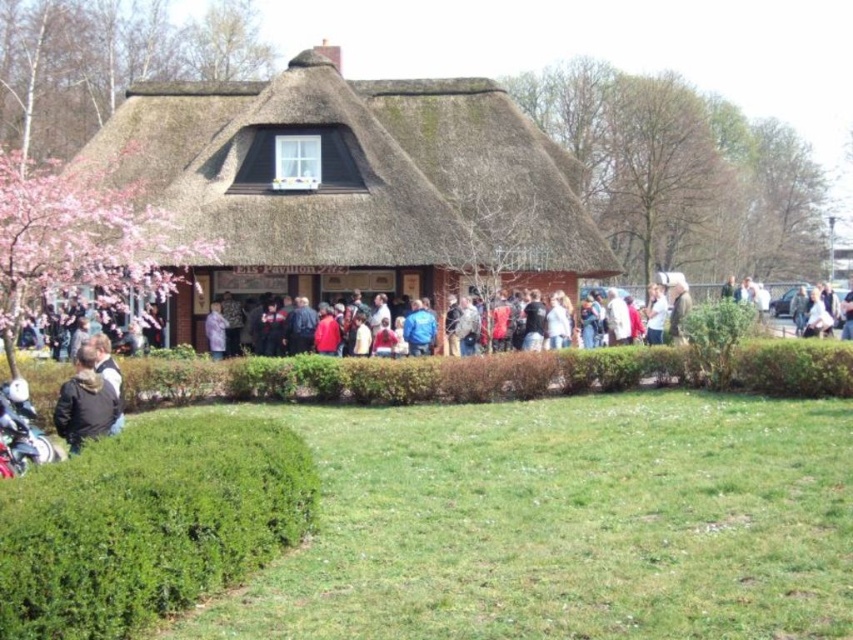
Question: Which object is closer to the camera taking this photo?

Choices:
 (A) green leafy hedge at lower left
 (B) green leafy hedge at center
 (C) green grass at center

Answer: (C)

Question: Is green leafy hedge at lower left further to the viewer compared to green leafy hedge at center?

Choices:
 (A) no
 (B) yes

Answer: (A)

Question: Among these objects, which one is farthest from the camera?

Choices:
 (A) thatched roof cottage at center
 (B) green leafy hedge at center
 (C) green grass at center

Answer: (A)

Question: Does green grass at center have a greater width compared to green leafy hedge at center?

Choices:
 (A) no
 (B) yes

Answer: (A)

Question: Which is farther from the green grass at center?

Choices:
 (A) thatched roof cottage at center
 (B) dark brown leather jacket at lower left
 (C) green leafy hedge at center

Answer: (A)

Question: In this image, where is green leafy hedge at center located relative to purple fabric at center?

Choices:
 (A) above
 (B) below

Answer: (B)